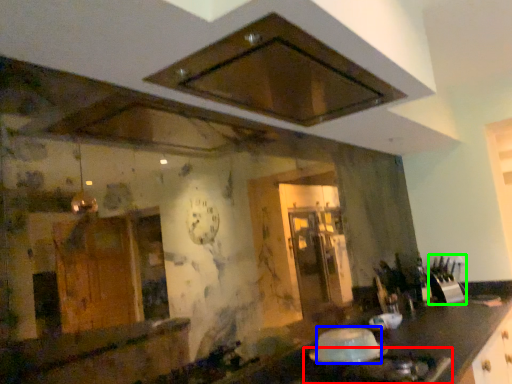
Question: Considering the real-world distances, which object is closest to gas stove (highlighted by a red box)? food (highlighted by a blue box) or appliance (highlighted by a green box).

Choices:
 (A) food
 (B) appliance

Answer: (A)